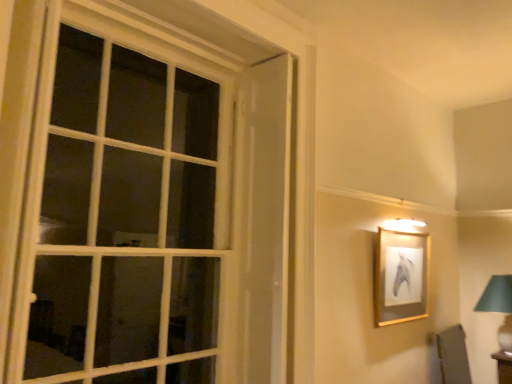
Question: From the image's perspective, would you say green fabric lampshade at right is shown under white glass window at left?

Choices:
 (A) no
 (B) yes

Answer: (B)

Question: Can you confirm if green fabric lampshade at right is bigger than white glass window at left?

Choices:
 (A) yes
 (B) no

Answer: (B)

Question: Does green fabric lampshade at right appear on the right side of white glass window at left?

Choices:
 (A) no
 (B) yes

Answer: (B)

Question: Is green fabric lampshade at right behind white glass window at left?

Choices:
 (A) no
 (B) yes

Answer: (B)

Question: Is green fabric lampshade at right positioned before white glass window at left?

Choices:
 (A) no
 (B) yes

Answer: (A)

Question: Is green fabric lampshade at right situated inside white glass window at left or outside?

Choices:
 (A) inside
 (B) outside

Answer: (B)

Question: Considering the relative positions of green fabric lampshade at right and white glass window at left in the image provided, is green fabric lampshade at right to the left or to the right of white glass window at left?

Choices:
 (A) right
 (B) left

Answer: (A)

Question: Looking at the image, does green fabric lampshade at right seem bigger or smaller compared to white glass window at left?

Choices:
 (A) small
 (B) big

Answer: (A)

Question: Considering their positions, is green fabric lampshade at right located in front of or behind white glass window at left?

Choices:
 (A) front
 (B) behind

Answer: (B)

Question: Considering their positions, is white glass window at left located in front of or behind green fabric lampshade at right?

Choices:
 (A) front
 (B) behind

Answer: (A)

Question: Would you say white glass window at left is to the left or to the right of green fabric lampshade at right in the picture?

Choices:
 (A) right
 (B) left

Answer: (B)

Question: Based on their sizes in the image, would you say white glass window at left is bigger or smaller than green fabric lampshade at right?

Choices:
 (A) big
 (B) small

Answer: (A)

Question: In terms of height, does white glass window at left look taller or shorter compared to green fabric lampshade at right?

Choices:
 (A) short
 (B) tall

Answer: (B)

Question: Visually, is green fabric lampshade at right positioned to the left or to the right of gold/glossy picture frame at upper right?

Choices:
 (A) right
 (B) left

Answer: (A)

Question: Considering the positions of green fabric lampshade at right and gold/glossy picture frame at upper right in the image, is green fabric lampshade at right wider or thinner than gold/glossy picture frame at upper right?

Choices:
 (A) thin
 (B) wide

Answer: (B)